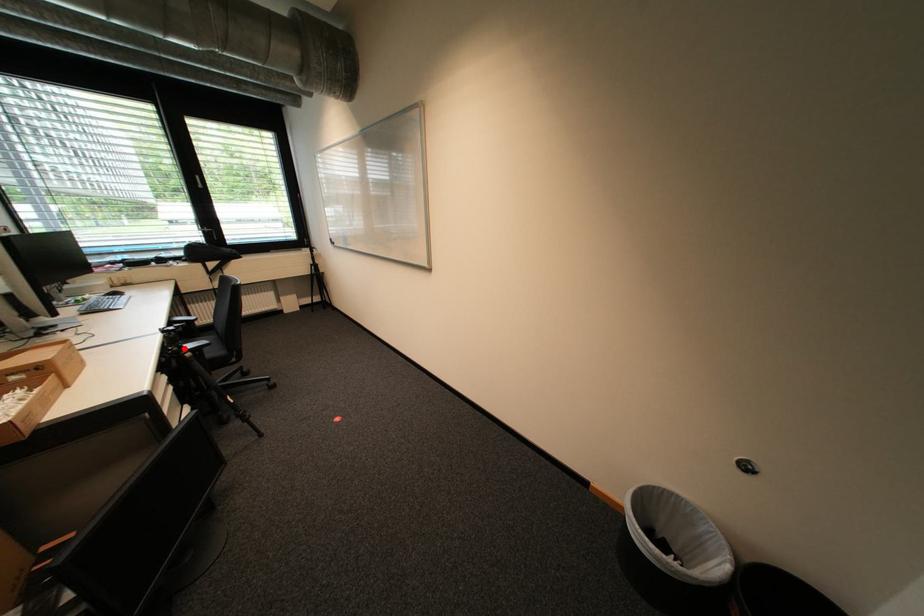
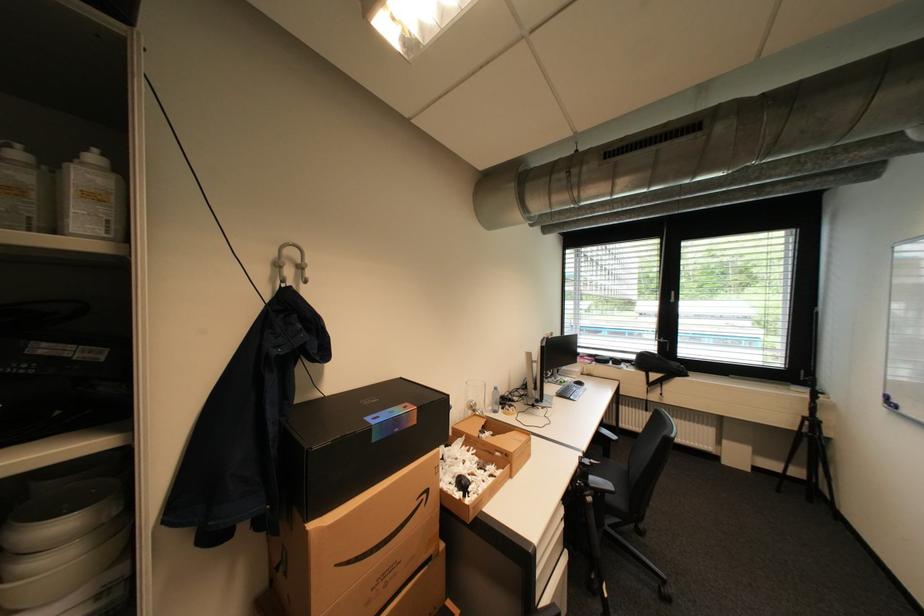
Where in the second image is the point corresponding to the highlighted location from the first image?

(591, 485)